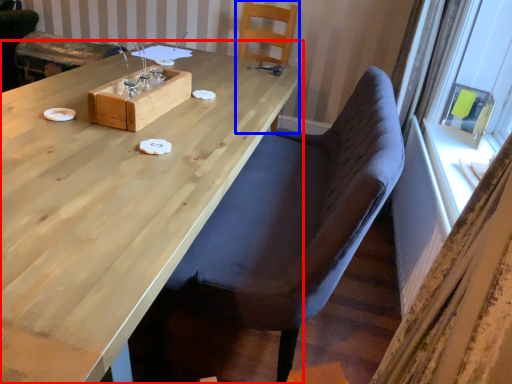
Question: Which point is further to the camera, table (highlighted by a red box) or chair (highlighted by a blue box)?

Choices:
 (A) table
 (B) chair

Answer: (B)